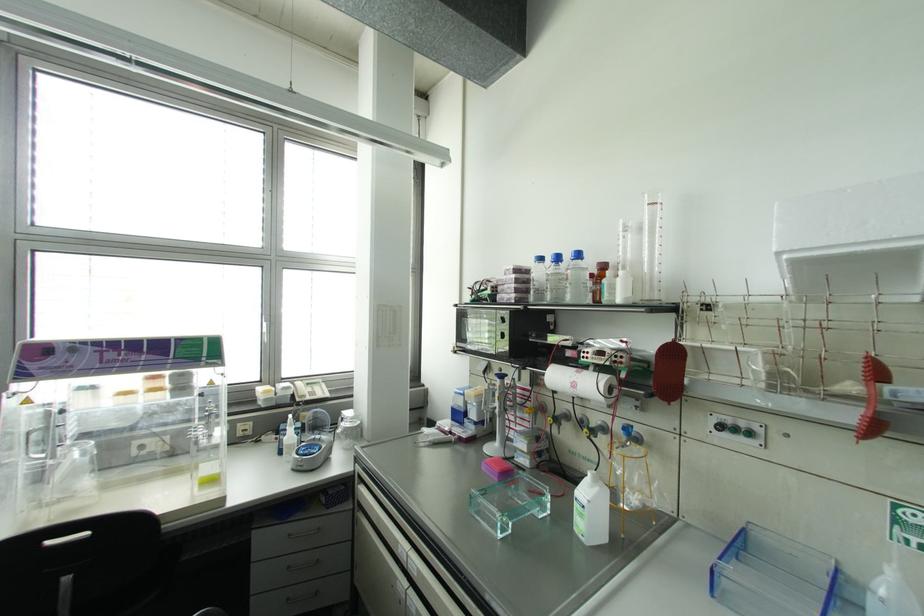
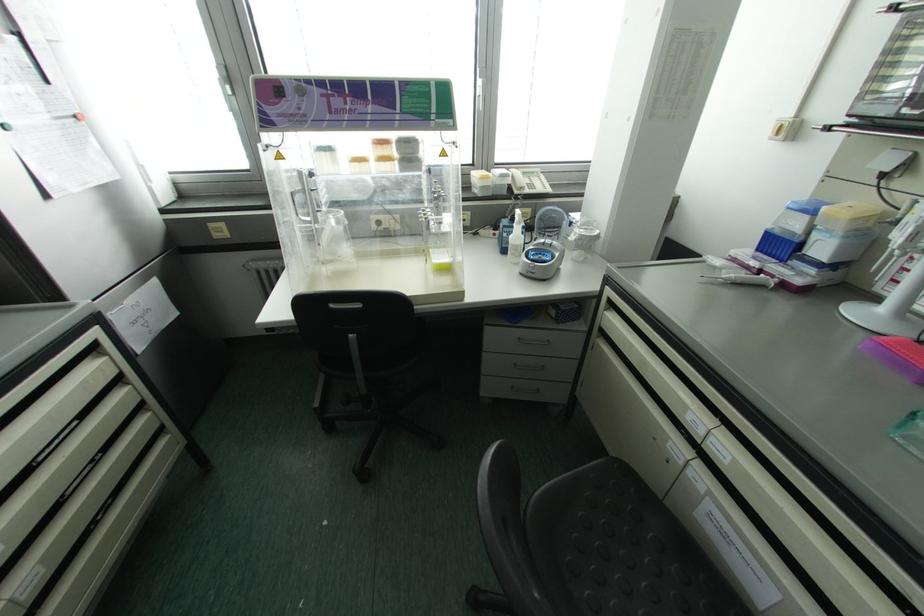
Where in the second image is the point corresponding to point (281, 451) from the first image?

(504, 251)